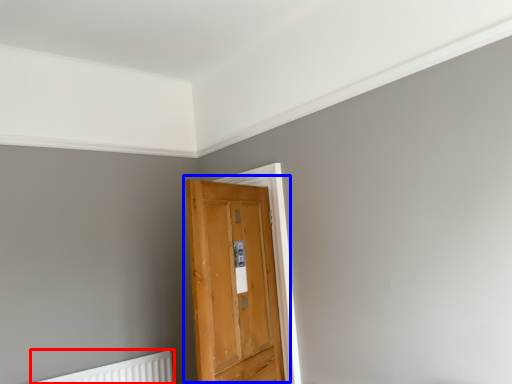
Question: Which object appears closest to the camera in this image, radiator (highlighted by a red box) or door (highlighted by a blue box)?

Choices:
 (A) radiator
 (B) door

Answer: (B)